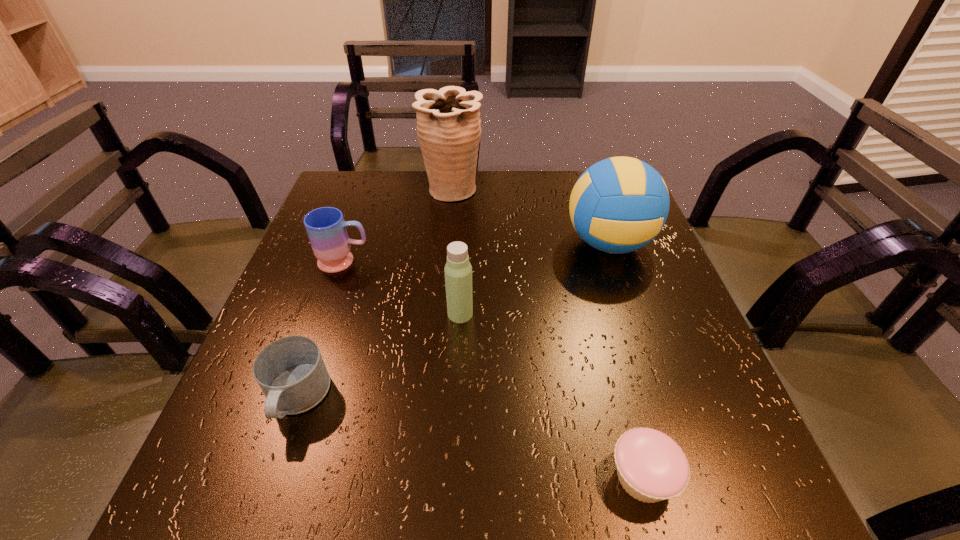
Identify which object is the fifth closest to the nearest object. Please provide its 2D coordinates. Your answer should be formatted as a tuple, i.e. [(x, y)], where the tuple contains the x and y coordinates of a point satisfying the conditions above.

[(448, 121)]

Where is `free region that satisfies the following two spatial constraints: 1. on the front side of the volleyball; 2. on the side of the taller mug with the handle`? The height and width of the screenshot is (540, 960). free region that satisfies the following two spatial constraints: 1. on the front side of the volleyball; 2. on the side of the taller mug with the handle is located at coordinates (615, 261).

This screenshot has height=540, width=960. I want to click on free point that satisfies the following two spatial constraints: 1. on the side of the shortest object with the handle; 2. on the right side of the second nearest object, so click(270, 477).

Locate an element on the screen. The height and width of the screenshot is (540, 960). free spot that satisfies the following two spatial constraints: 1. on the side of the second nearest object with the handle; 2. on the right side of the shortest object is located at coordinates (270, 477).

I want to click on free region that satisfies the following two spatial constraints: 1. on the back side of the shortest object; 2. on the side of the third shortest object with the handle, so 586,261.

You are a GUI agent. You are given a task and a screenshot of the screen. Output one action in this format:
    pyautogui.click(x=<x>, y=<y>)
    Task: Click on the free location that satisfies the following two spatial constraints: 1. on the side of the farther mug with the handle; 2. on the right side of the shortest object
    
    Given the screenshot: What is the action you would take?
    pyautogui.click(x=271, y=477)

Find the location of a particular element. This screenshot has width=960, height=540. free space that satisfies the following two spatial constraints: 1. on the side of the fourth tallest object with the handle; 2. on the side of the shorter mug with the handle is located at coordinates (298, 398).

At what (x,y) coordinates should I click in order to perform the action: click on vacant position in the image that satisfies the following two spatial constraints: 1. on the side of the taller mug with the handle; 2. on the right side of the fourth shortest object. Please return your answer as a coordinate pair (x, y). Looking at the image, I should click on (326, 314).